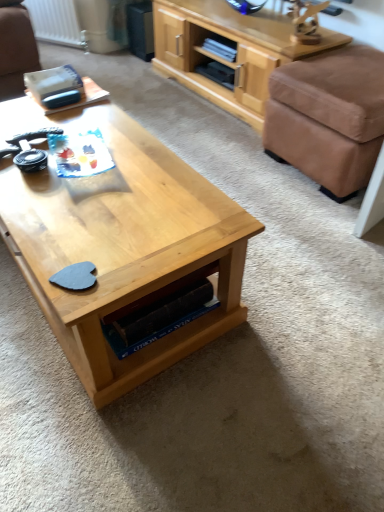
The width and height of the screenshot is (384, 512). What are the coordinates of `free space in front of light wood coffee table at center` in the screenshot? It's located at (130, 415).